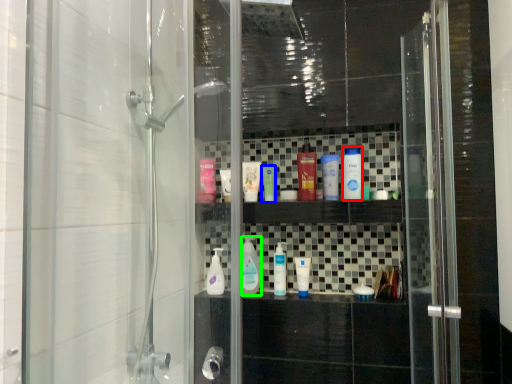
Question: Which object is the closest to the mouthwash (highlighted by a red box)? Choose among these: mouthwash (highlighted by a blue box) or mouthwash (highlighted by a green box).

Choices:
 (A) mouthwash
 (B) mouthwash

Answer: (A)